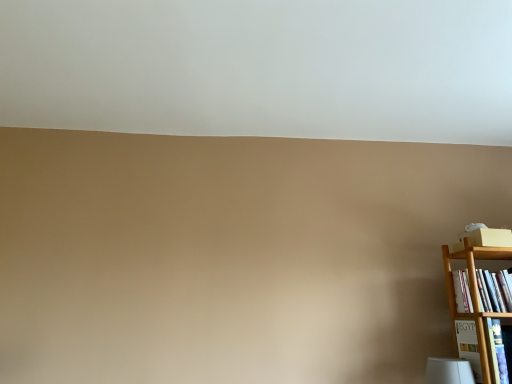
Image resolution: width=512 pixels, height=384 pixels. I want to click on wooden bookshelf at right, so click(493, 291).

What do you see at coordinates (493, 291) in the screenshot? I see `wooden bookshelf at right` at bounding box center [493, 291].

The width and height of the screenshot is (512, 384). In order to click on wooden bookshelf at right in this screenshot , I will do `click(493, 291)`.